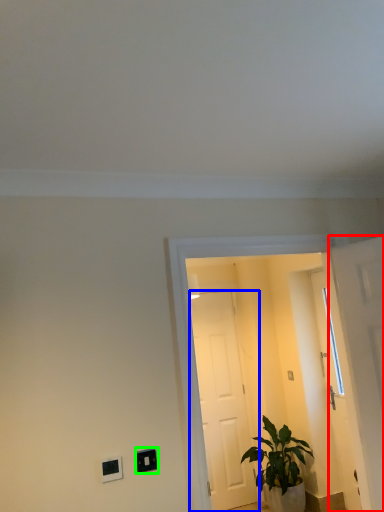
Question: Based on their relative distances, which object is nearer to door (highlighted by a red box)? Choose from door (highlighted by a blue box) and light switch (highlighted by a green box).

Choices:
 (A) door
 (B) light switch

Answer: (B)